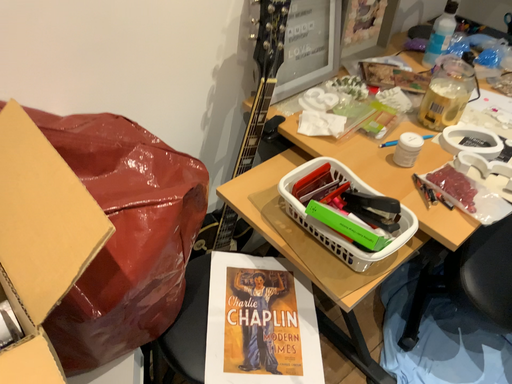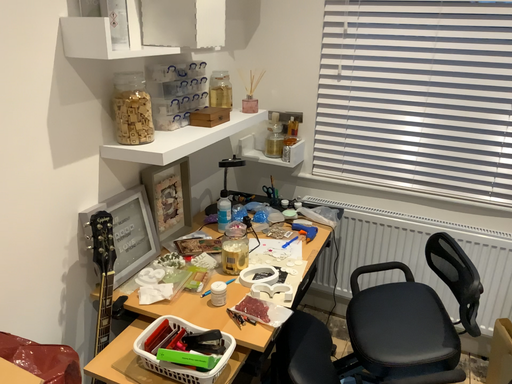
Question: Which way did the camera rotate in the video?

Choices:
 (A) rotated right
 (B) rotated left

Answer: (A)